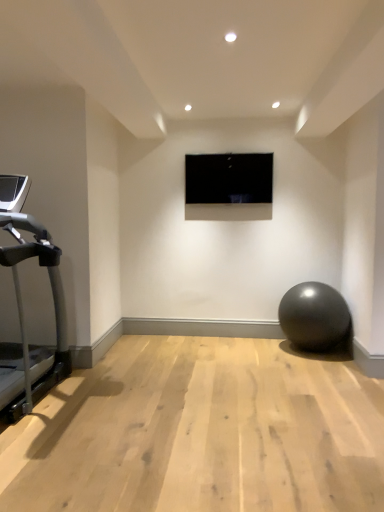
Question: Is silver metallic treadmill at left thinner than black glossy screen at center?

Choices:
 (A) no
 (B) yes

Answer: (A)

Question: Is silver metallic treadmill at left positioned with its back to black glossy screen at center?

Choices:
 (A) yes
 (B) no

Answer: (B)

Question: Is silver metallic treadmill at left closer to camera compared to black glossy screen at center?

Choices:
 (A) no
 (B) yes

Answer: (B)

Question: Considering the relative sizes of silver metallic treadmill at left and black glossy screen at center in the image provided, is silver metallic treadmill at left taller than black glossy screen at center?

Choices:
 (A) no
 (B) yes

Answer: (B)

Question: Is silver metallic treadmill at left oriented towards black glossy screen at center?

Choices:
 (A) yes
 (B) no

Answer: (B)

Question: From a real-world perspective, is silver metallic treadmill at left positioned above or below matte gray ball at lower right?

Choices:
 (A) below
 (B) above

Answer: (B)

Question: Relative to matte gray ball at lower right, is silver metallic treadmill at left in front or behind?

Choices:
 (A) front
 (B) behind

Answer: (A)

Question: Is silver metallic treadmill at left inside the boundaries of matte gray ball at lower right, or outside?

Choices:
 (A) inside
 (B) outside

Answer: (B)

Question: From the image's perspective, relative to matte gray ball at lower right, is silver metallic treadmill at left above or below?

Choices:
 (A) above
 (B) below

Answer: (A)

Question: In terms of size, does silver metallic treadmill at left appear bigger or smaller than black glossy screen at center?

Choices:
 (A) small
 (B) big

Answer: (B)

Question: From the image's perspective, is silver metallic treadmill at left located above or below black glossy screen at center?

Choices:
 (A) below
 (B) above

Answer: (A)

Question: From a real-world perspective, is silver metallic treadmill at left above or below black glossy screen at center?

Choices:
 (A) above
 (B) below

Answer: (B)

Question: Is silver metallic treadmill at left wider or thinner than black glossy screen at center?

Choices:
 (A) wide
 (B) thin

Answer: (A)

Question: In terms of height, does matte gray ball at lower right look taller or shorter compared to black glossy screen at center?

Choices:
 (A) tall
 (B) short

Answer: (A)

Question: From the image's perspective, is matte gray ball at lower right above or below black glossy screen at center?

Choices:
 (A) above
 (B) below

Answer: (B)